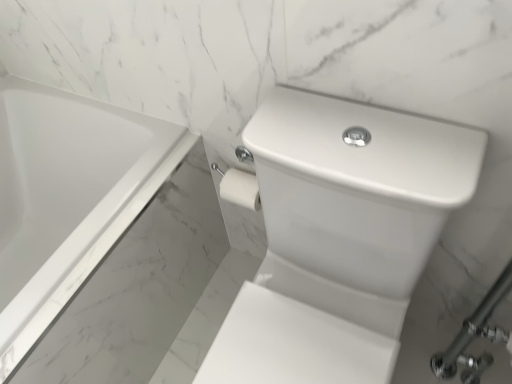
Question: Considering the relative sizes of white glossy bathtub at upper left and white glossy sink at center in the image provided, is white glossy bathtub at upper left taller than white glossy sink at center?

Choices:
 (A) yes
 (B) no

Answer: (B)

Question: Is white glossy sink at center a part of white glossy bathtub at upper left?

Choices:
 (A) no
 (B) yes

Answer: (A)

Question: Is white glossy bathtub at upper left at the left side of white glossy sink at center?

Choices:
 (A) no
 (B) yes

Answer: (B)

Question: Considering the relative sizes of white glossy bathtub at upper left and white glossy sink at center in the image provided, is white glossy bathtub at upper left thinner than white glossy sink at center?

Choices:
 (A) yes
 (B) no

Answer: (B)

Question: Is white glossy bathtub at upper left not close to white glossy sink at center?

Choices:
 (A) yes
 (B) no

Answer: (B)

Question: Is white glossy bathtub at upper left wider than white glossy sink at center?

Choices:
 (A) yes
 (B) no

Answer: (A)

Question: Can you confirm if white glossy sink at center is bigger than white glossy bathtub at upper left?

Choices:
 (A) yes
 (B) no

Answer: (B)

Question: From the image's perspective, is white glossy sink at center above white glossy bathtub at upper left?

Choices:
 (A) yes
 (B) no

Answer: (B)

Question: Is white glossy sink at center positioned before white glossy bathtub at upper left?

Choices:
 (A) no
 (B) yes

Answer: (B)

Question: Considering the relative sizes of white glossy sink at center and white glossy bathtub at upper left in the image provided, is white glossy sink at center shorter than white glossy bathtub at upper left?

Choices:
 (A) no
 (B) yes

Answer: (A)

Question: Is white glossy sink at center at the right side of white glossy bathtub at upper left?

Choices:
 (A) yes
 (B) no

Answer: (A)

Question: Could white glossy bathtub at upper left be considered to be inside white glossy sink at center?

Choices:
 (A) yes
 (B) no

Answer: (B)

Question: In terms of width, does white glossy sink at center look wider or thinner when compared to white glossy bathtub at upper left?

Choices:
 (A) wide
 (B) thin

Answer: (B)